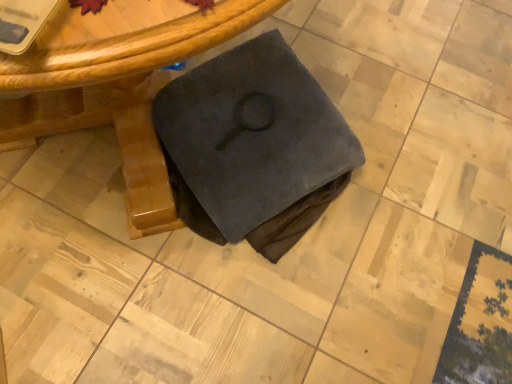
Question: Should I look upward or downward to see wooden table at center?

Choices:
 (A) up
 (B) down

Answer: (A)

Question: Is wooden table at center smaller than dark suede book at center?

Choices:
 (A) no
 (B) yes

Answer: (A)

Question: Can we say wooden table at center lies outside dark suede book at center?

Choices:
 (A) yes
 (B) no

Answer: (A)

Question: From a real-world perspective, is wooden table at center over dark suede book at center?

Choices:
 (A) no
 (B) yes

Answer: (B)

Question: Does wooden table at center have a larger size compared to dark suede book at center?

Choices:
 (A) no
 (B) yes

Answer: (B)

Question: Can you confirm if wooden table at center is wider than dark suede book at center?

Choices:
 (A) yes
 (B) no

Answer: (A)

Question: Is wooden table at center shorter than dark suede book at center?

Choices:
 (A) yes
 (B) no

Answer: (B)

Question: Considering the relative sizes of dark suede book at center and wooden table at center in the image provided, is dark suede book at center shorter than wooden table at center?

Choices:
 (A) yes
 (B) no

Answer: (A)

Question: Could you tell me if dark suede book at center is facing wooden table at center?

Choices:
 (A) yes
 (B) no

Answer: (A)

Question: Is dark suede book at center thinner than wooden table at center?

Choices:
 (A) no
 (B) yes

Answer: (B)

Question: From a real-world perspective, does dark suede book at center sit lower than wooden table at center?

Choices:
 (A) yes
 (B) no

Answer: (A)

Question: Considering the relative sizes of dark suede book at center and wooden table at center in the image provided, is dark suede book at center smaller than wooden table at center?

Choices:
 (A) no
 (B) yes

Answer: (B)

Question: Can you confirm if dark suede book at center is taller than wooden table at center?

Choices:
 (A) yes
 (B) no

Answer: (B)

Question: Is wooden table at center inside or outside of dark suede book at center?

Choices:
 (A) outside
 (B) inside

Answer: (A)